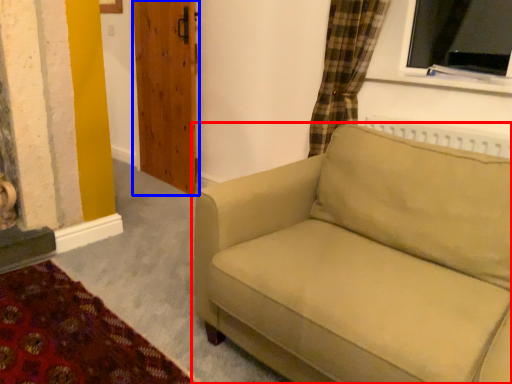
Question: Among these objects, which one is nearest to the camera, studio couch (highlighted by a red box) or door (highlighted by a blue box)?

Choices:
 (A) studio couch
 (B) door

Answer: (A)